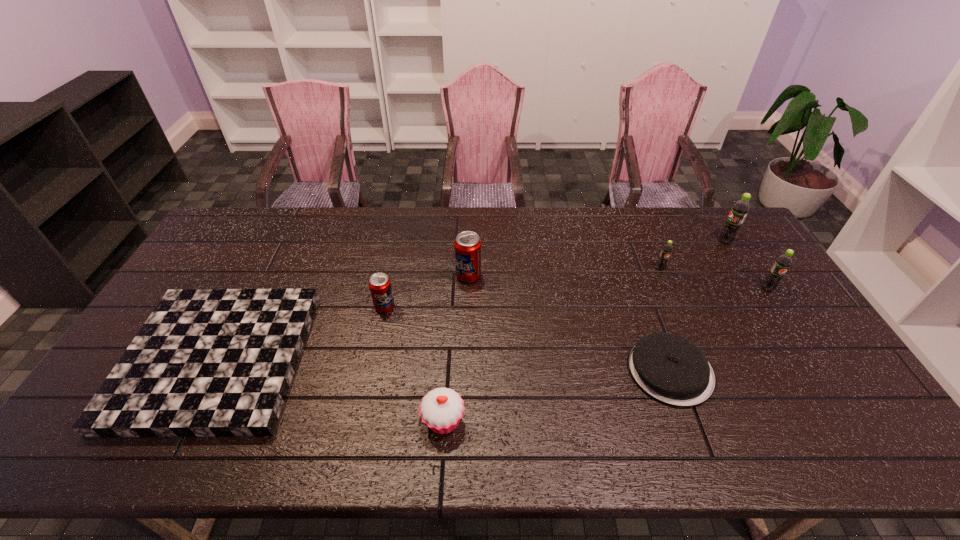
You are a GUI agent. You are given a task and a screenshot of the screen. Output one action in this format:
    pyautogui.click(x=<x>, y=<y>)
    Task: Click on the empty location between the second shortest object and the pink cupcake
    The height and width of the screenshot is (540, 960).
    Given the screenshot: What is the action you would take?
    pyautogui.click(x=557, y=395)

Locate an element on the screen. vacant point located between the nearest green soda and the leftmost object is located at coordinates (492, 323).

Identify the location of empty location between the second biggest green soda and the tallest object. The height and width of the screenshot is (540, 960). (746, 265).

I want to click on empty space that is in between the nearest green soda and the cupcake, so click(x=605, y=354).

Identify which object is the fifth nearest to the farthest soda. Please provide its 2D coordinates. Your answer should be formatted as a tuple, i.e. [(x, y)], where the tuple contains the x and y coordinates of a point satisfying the conditions above.

[(441, 410)]

Locate an element on the screen. The height and width of the screenshot is (540, 960). object that ranks as the third closest to the second shortest object is located at coordinates click(441, 410).

Identify which soda is the fifth closest to the shortest object. Please provide its 2D coordinates. Your answer should be formatted as a tuple, i.e. [(x, y)], where the tuple contains the x and y coordinates of a point satisfying the conditions above.

[(780, 267)]

You are a GUI agent. You are given a task and a screenshot of the screen. Output one action in this format:
    pyautogui.click(x=<x>, y=<y>)
    Task: Click on the soda that is the second nearest to the bigger red soda can
    This screenshot has height=540, width=960.
    Given the screenshot: What is the action you would take?
    pyautogui.click(x=666, y=251)

Identify which green soda is the third closest to the shortest object. Please provide its 2D coordinates. Your answer should be formatted as a tuple, i.e. [(x, y)], where the tuple contains the x and y coordinates of a point satisfying the conditions above.

[(780, 267)]

Locate an element on the screen. green soda that is the closest to the bigger red soda can is located at coordinates (666, 251).